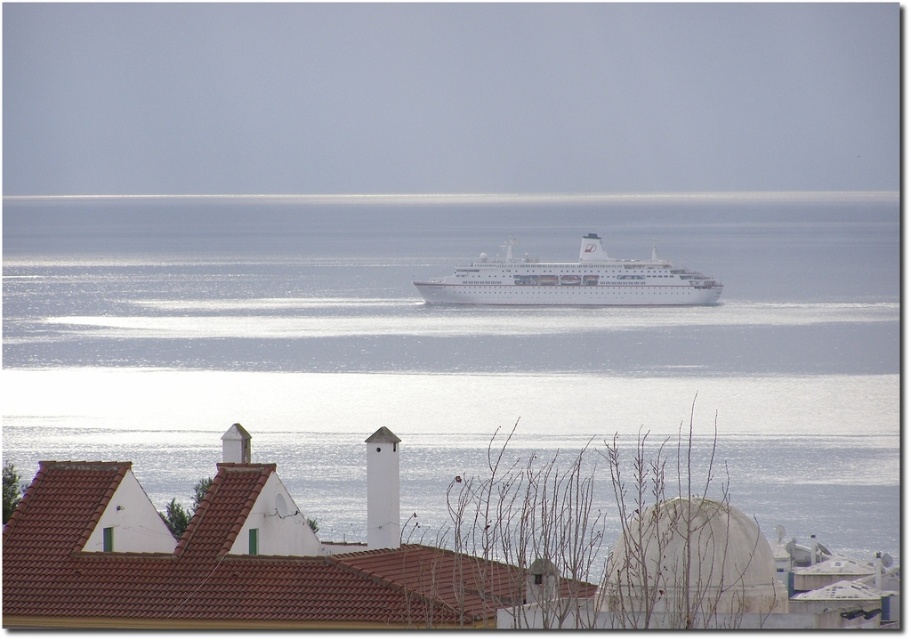
How far apart are blue water at center and white glossy cruise ship at center?

blue water at center and white glossy cruise ship at center are 30.08 meters apart.

Where is `blue water at center`? The height and width of the screenshot is (640, 911). blue water at center is located at coordinates (453, 344).